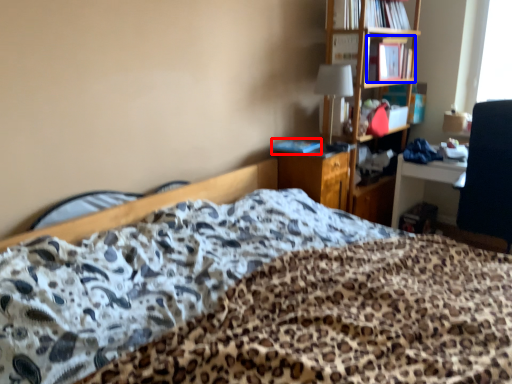
Question: Which point is closer to the camera, book (highlighted by a red box) or book (highlighted by a blue box)?

Choices:
 (A) book
 (B) book

Answer: (A)